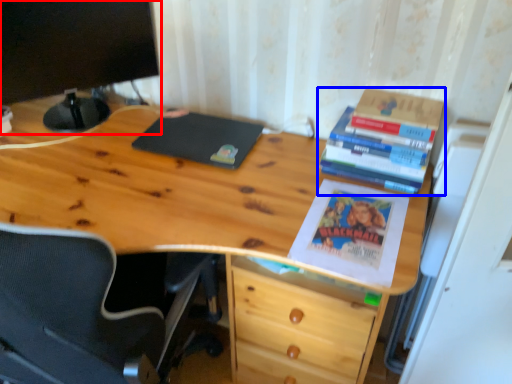
Question: Which object is closer to the camera taking this photo, computer monitor (highlighted by a red box) or book (highlighted by a blue box)?

Choices:
 (A) computer monitor
 (B) book

Answer: (B)